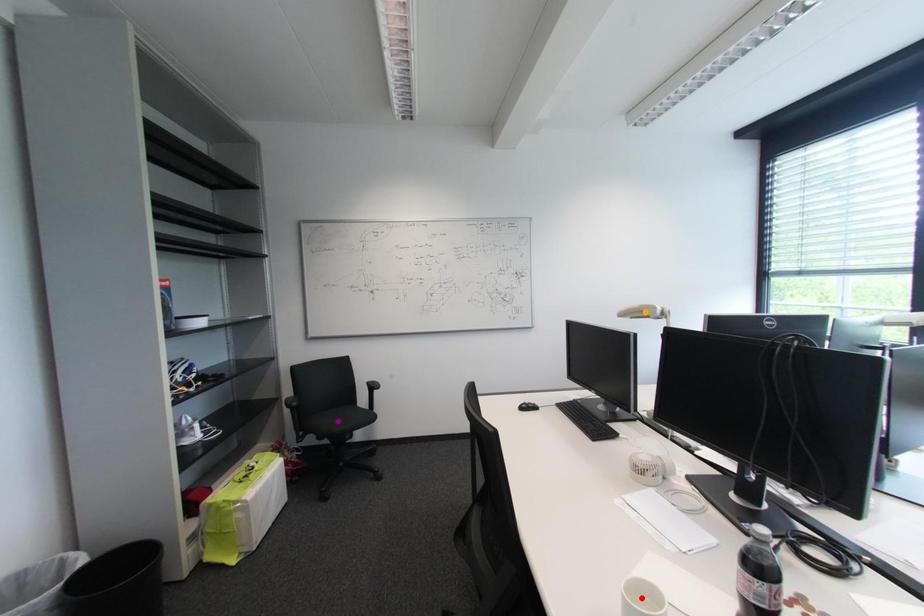
Order these from nearest to farthest:
red point | purple point | orange point

red point, orange point, purple point